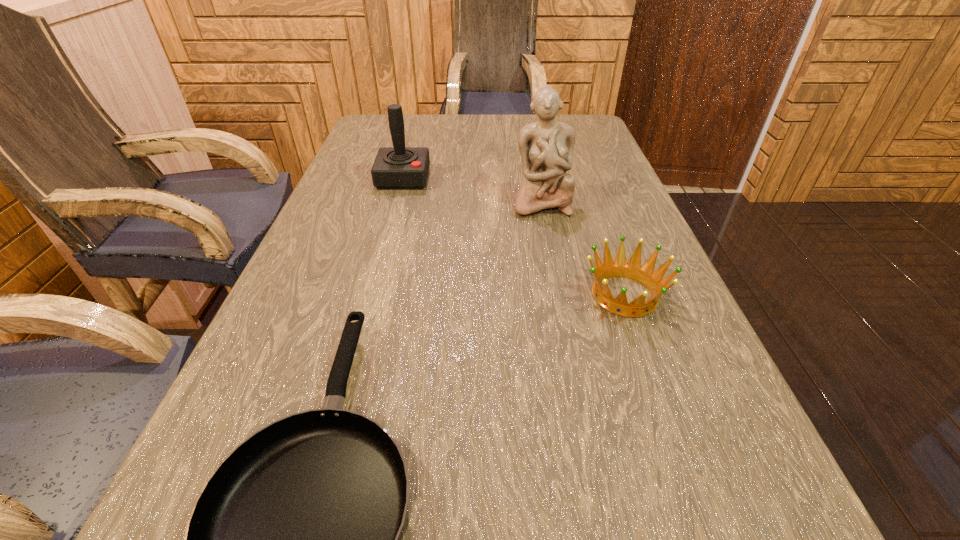
Identify which object is the second nearest to the tallest object. Please provide its 2D coordinates. Your answer should be formatted as a tuple, i.e. [(x, y)], where the tuple contains the x and y coordinates of a point satisfying the conditions above.

[(398, 167)]

I want to click on vacant space that satisfies the following two spatial constraints: 1. on the front-facing side of the figurine; 2. on the right side of the second shortest object, so click(559, 295).